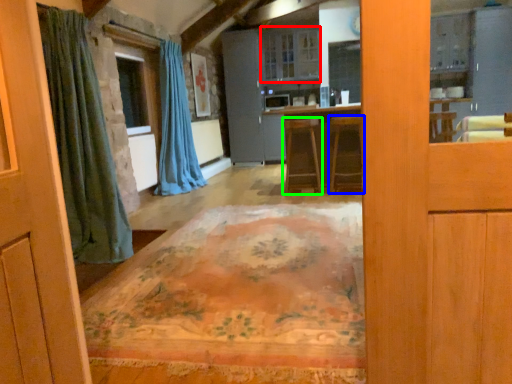
Question: Which is nearer to the cabinetry (highlighted by a red box)? furniture (highlighted by a blue box) or furniture (highlighted by a green box).

Choices:
 (A) furniture
 (B) furniture

Answer: (B)